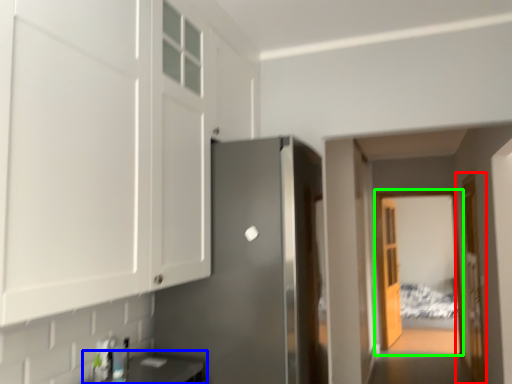
Question: Estimate the real-world distances between objects in this image. Which object is farther from door (highlighted by a red box), counter top (highlighted by a blue box) or glass door (highlighted by a green box)?

Choices:
 (A) counter top
 (B) glass door

Answer: (A)